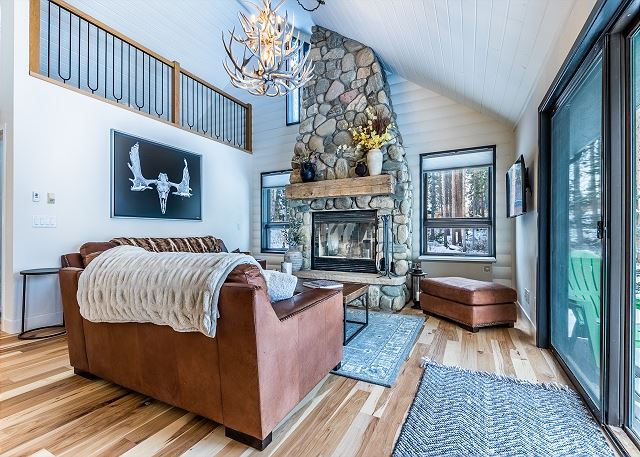
Locate an element on the screen. This screenshot has height=457, width=640. slopped ceiling is located at coordinates (516, 15), (361, 9), (470, 48), (169, 44), (205, 56).